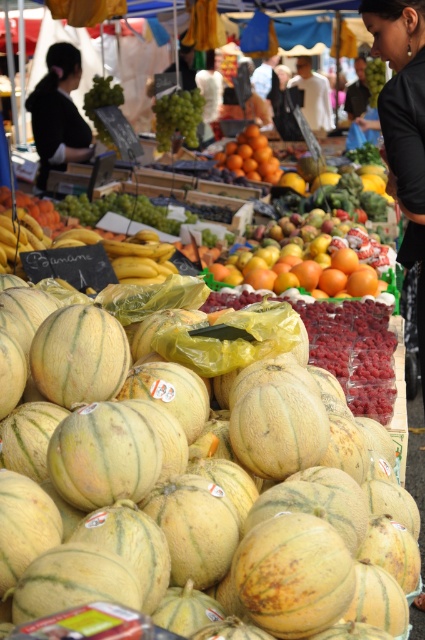
This screenshot has width=425, height=640. What do you see at coordinates (59, 113) in the screenshot?
I see `black fabric at center` at bounding box center [59, 113].

Which of these two, black fabric at center or orange matte at center, stands taller?

With more height is black fabric at center.

I want to click on black fabric at center, so [x=59, y=113].

Is point (410, 12) closer to viewer compared to point (198, 120)?

Yes, point (410, 12) is in front of point (198, 120).

Can you confirm if black fabric at upper right is taller than green matte grapes at upper center?

Yes.

The width and height of the screenshot is (425, 640). What do you see at coordinates (404, 125) in the screenshot?
I see `black fabric at upper right` at bounding box center [404, 125].

Find the location of `black fabric at upper right`. black fabric at upper right is located at coordinates (404, 125).

Is green striped cantaloupe at center thinner than green matte grapes at upper center?

Incorrect, green striped cantaloupe at center's width is not less than green matte grapes at upper center's.

Is green striped cantaloupe at center above green matte grapes at upper center?

No.

Is point (166, 499) farther from viewer compared to point (175, 97)?

That is False.

This screenshot has height=640, width=425. What are the coordinates of `green striped cantaloupe at center` in the screenshot? It's located at (201, 497).